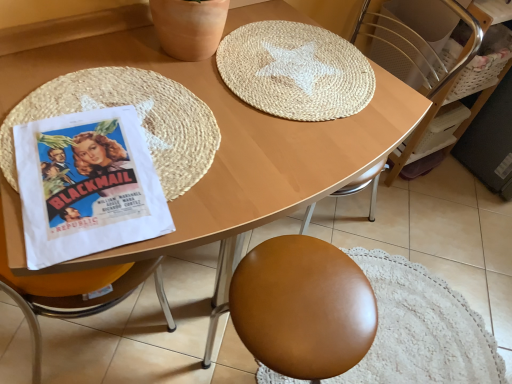
Question: Considering the relative positions of wooden at upper center and white paper poster at left in the image provided, is wooden at upper center to the right of white paper poster at left from the viewer's perspective?

Choices:
 (A) no
 (B) yes

Answer: (B)

Question: Is wooden at upper center next to white paper poster at left and touching it?

Choices:
 (A) yes
 (B) no

Answer: (B)

Question: Can we say wooden at upper center lies outside white paper poster at left?

Choices:
 (A) yes
 (B) no

Answer: (A)

Question: From a real-world perspective, is wooden at upper center beneath white paper poster at left?

Choices:
 (A) no
 (B) yes

Answer: (B)

Question: Is white paper poster at left inside wooden at upper center?

Choices:
 (A) no
 (B) yes

Answer: (A)

Question: Does wooden at upper center appear on the left side of white paper poster at left?

Choices:
 (A) no
 (B) yes

Answer: (A)

Question: Does white woven basket at upper right come behind natural fiber mat at upper center, the second mat positioned from the left?

Choices:
 (A) yes
 (B) no

Answer: (A)

Question: Is white woven basket at upper right not inside natural fiber mat at upper center, arranged as the first mat when viewed from the right?

Choices:
 (A) yes
 (B) no

Answer: (A)

Question: Can you confirm if white woven basket at upper right is bigger than natural fiber mat at upper center, the second mat positioned from the left?

Choices:
 (A) no
 (B) yes

Answer: (B)

Question: Does white woven basket at upper right have a greater width compared to natural fiber mat at upper center, the second mat positioned from the left?

Choices:
 (A) no
 (B) yes

Answer: (A)

Question: Is white woven basket at upper right to the left of natural fiber mat at upper center, the second mat positioned from the left, from the viewer's perspective?

Choices:
 (A) no
 (B) yes

Answer: (A)

Question: Is natural fiber mat at upper center, arranged as the first mat when viewed from the right, a part of white woven basket at upper right?

Choices:
 (A) no
 (B) yes

Answer: (A)

Question: From the image's perspective, is woven straw placemat at left, which ranks as the 2th mat in right-to-left order, on white woven basket at upper right?

Choices:
 (A) no
 (B) yes

Answer: (A)